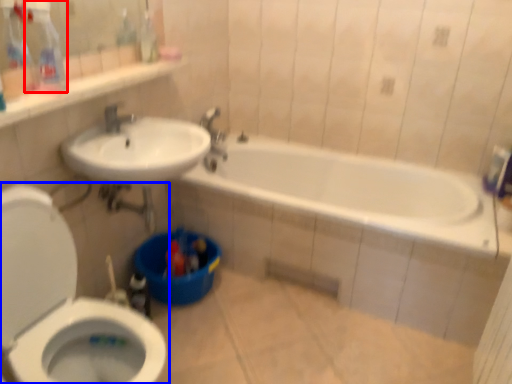
Question: Which object appears closest to the camera in this image, cleaning product (highlighted by a red box) or toilet (highlighted by a blue box)?

Choices:
 (A) cleaning product
 (B) toilet

Answer: (B)